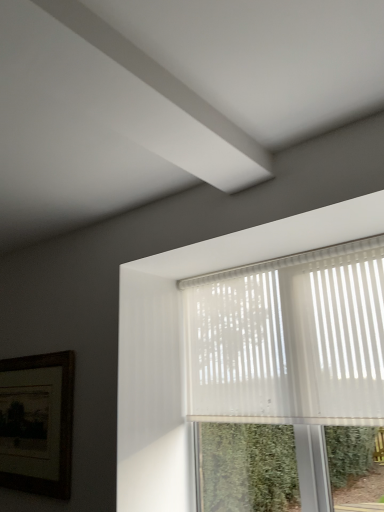
Question: From the image's perspective, is translucent plastic window at upper right above or below wooden framed picture at lower left?

Choices:
 (A) below
 (B) above

Answer: (B)

Question: Looking at the image, does translucent plastic window at upper right seem bigger or smaller compared to wooden framed picture at lower left?

Choices:
 (A) small
 (B) big

Answer: (B)

Question: Considering the relative positions of translucent plastic window at upper right and wooden framed picture at lower left in the image provided, is translucent plastic window at upper right to the left or to the right of wooden framed picture at lower left?

Choices:
 (A) right
 (B) left

Answer: (A)

Question: Is wooden framed picture at lower left in front of or behind translucent plastic window at upper right in the image?

Choices:
 (A) behind
 (B) front

Answer: (A)

Question: In terms of height, does wooden framed picture at lower left look taller or shorter compared to translucent plastic window at upper right?

Choices:
 (A) tall
 (B) short

Answer: (B)

Question: Does point (23, 381) appear closer or farther from the camera than point (342, 253)?

Choices:
 (A) closer
 (B) farther

Answer: (B)

Question: From the image's perspective, is wooden framed picture at lower left above or below translucent plastic window at upper right?

Choices:
 (A) above
 (B) below

Answer: (B)